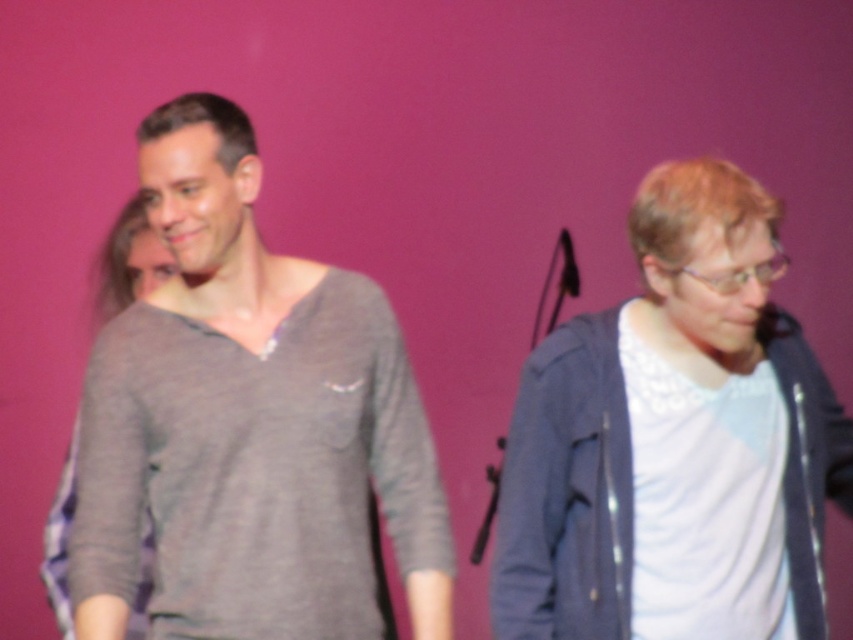
Which is above, gray cotton shirt at left or white matte jacket at right?

gray cotton shirt at left is above.

Is point (273, 278) more distant than point (651, 253)?

Yes, it is.

Measure the distance between gray cotton shirt at left and camera.

gray cotton shirt at left and camera are 5.92 feet apart.

Identify the location of gray cotton shirt at left. This screenshot has width=853, height=640. (248, 422).

Is the position of gray cotton shirt at left more distant than that of matte gray sweater at left?

No, gray cotton shirt at left is in front of matte gray sweater at left.

Between gray cotton shirt at left and matte gray sweater at left, which one has more height?

gray cotton shirt at left is taller.

Between point (294, 636) and point (148, 580), which one is positioned in front?

Point (294, 636)

Locate an element on the screen. This screenshot has height=640, width=853. gray cotton shirt at left is located at coordinates (248, 422).

Which of these two, white matte jacket at right or matte gray sweater at left, stands shorter?

matte gray sweater at left

Does point (666, 403) come closer to viewer compared to point (73, 627)?

Yes, it is in front of point (73, 627).

Is point (810, 380) positioned before point (62, 486)?

Yes, point (810, 380) is in front of point (62, 486).

Identify the location of white matte jacket at right. Image resolution: width=853 pixels, height=640 pixels. (674, 440).